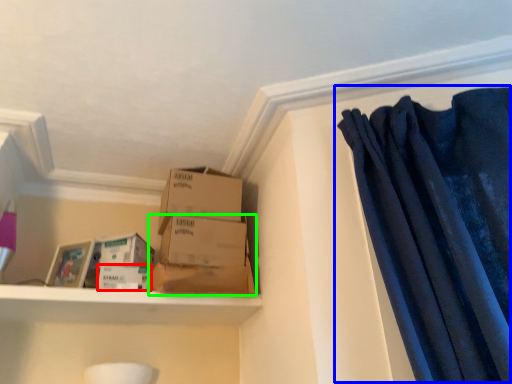
Question: Based on their relative distances, which object is farther from storage box (highlighted by a red box)? Choose from curtain (highlighted by a blue box) and box (highlighted by a green box).

Choices:
 (A) curtain
 (B) box

Answer: (A)